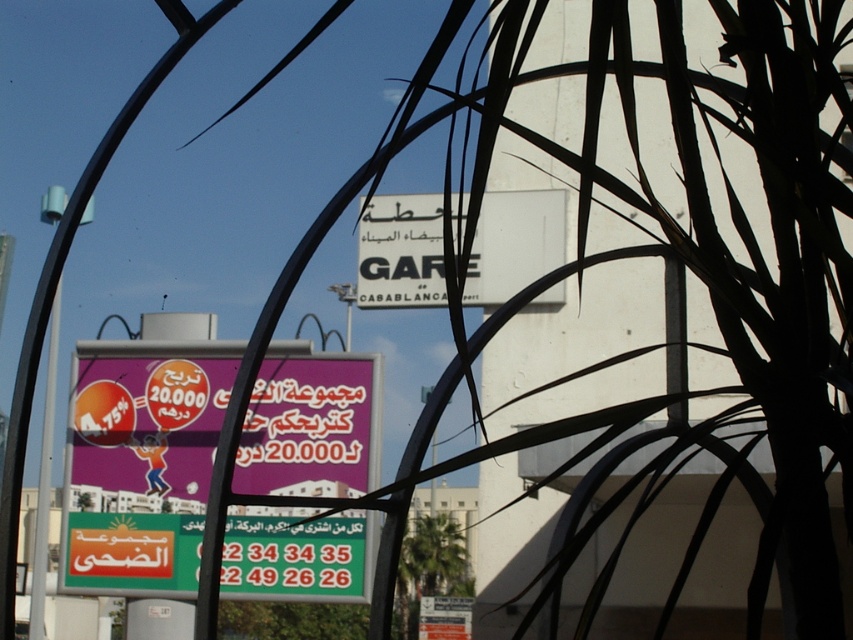
Question: Is purple glossy signboard at center bigger than white matte sign at center?

Choices:
 (A) no
 (B) yes

Answer: (B)

Question: Can you confirm if purple glossy signboard at center is positioned above white matte sign at center?

Choices:
 (A) yes
 (B) no

Answer: (B)

Question: Can you confirm if purple glossy signboard at center is positioned below white matte sign at center?

Choices:
 (A) yes
 (B) no

Answer: (A)